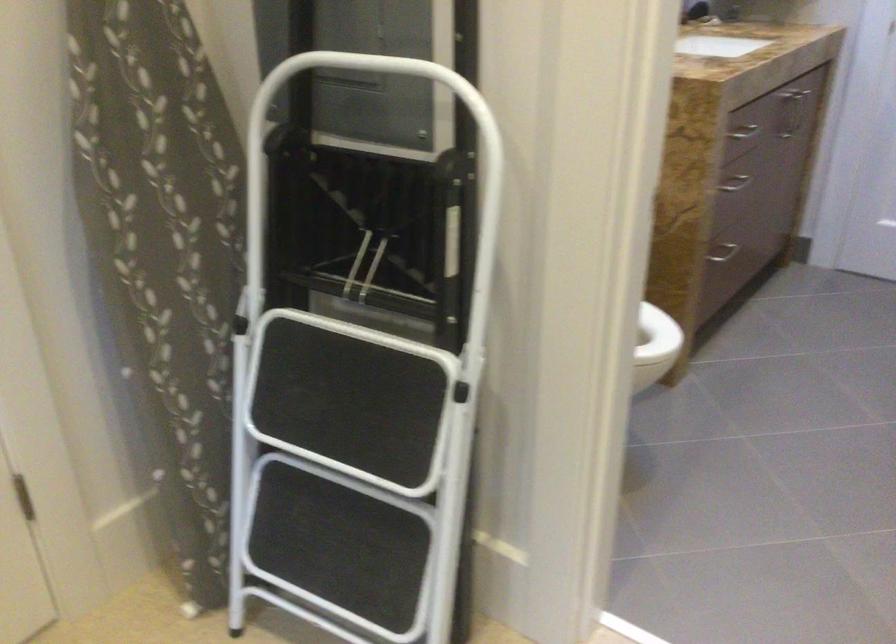
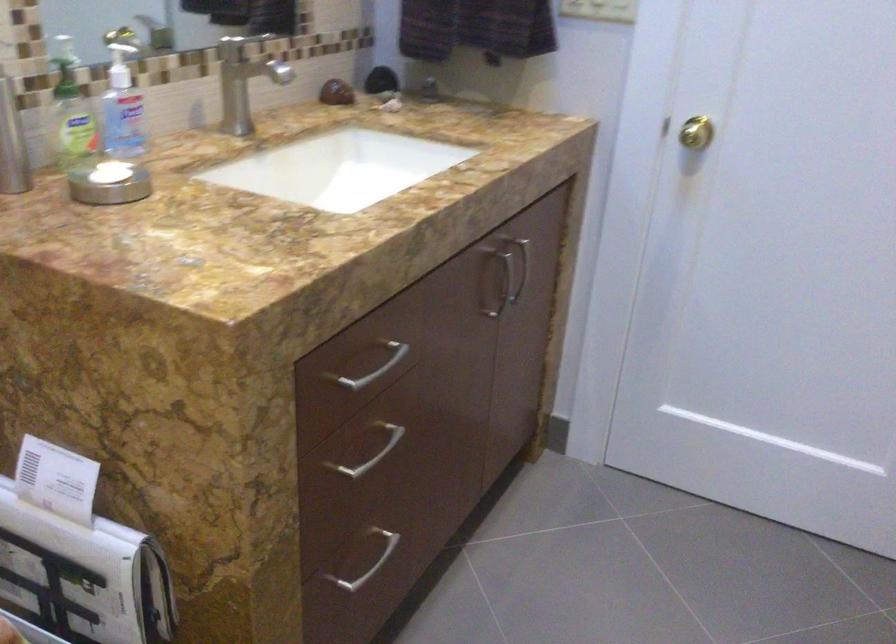
Which direction would the cameraman need to move to produce the second image?

The movement direction of the cameraman is right, forward.